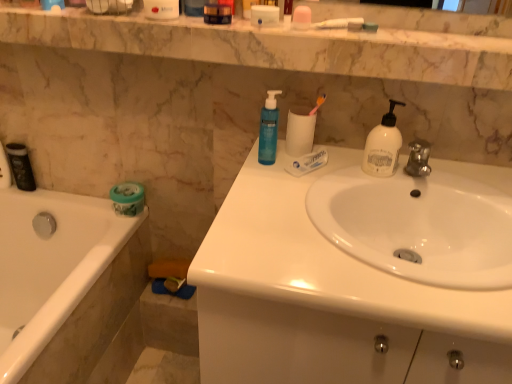
Question: Is marble at upper center to the left of white glossy bathtub at left from the viewer's perspective?

Choices:
 (A) no
 (B) yes

Answer: (A)

Question: From a real-world perspective, is marble at upper center on top of white glossy bathtub at left?

Choices:
 (A) yes
 (B) no

Answer: (A)

Question: From a real-world perspective, does marble at upper center sit lower than white glossy bathtub at left?

Choices:
 (A) no
 (B) yes

Answer: (A)

Question: Is marble at upper center positioned beyond the bounds of white glossy bathtub at left?

Choices:
 (A) no
 (B) yes

Answer: (B)

Question: Is marble at upper center positioned before white glossy bathtub at left?

Choices:
 (A) yes
 (B) no

Answer: (A)

Question: Considering the positions of point (287, 152) and point (300, 157), is point (287, 152) closer or farther from the camera than point (300, 157)?

Choices:
 (A) closer
 (B) farther

Answer: (B)

Question: Considering their positions, is white matte toilet paper at center, which is the second toilet paper in bottom-to-top order, located in front of or behind translucent white tube at center?

Choices:
 (A) front
 (B) behind

Answer: (B)

Question: Based on their positions, is white matte toilet paper at center, which is the second toilet paper in bottom-to-top order, located to the left or right of translucent white tube at center?

Choices:
 (A) right
 (B) left

Answer: (B)

Question: Which is correct: white matte toilet paper at center, which is the second toilet paper in bottom-to-top order, is inside translucent white tube at center, or outside of it?

Choices:
 (A) outside
 (B) inside

Answer: (A)

Question: In terms of height, does black matte canister at left look taller or shorter compared to white glossy sink at center, positioned as the 2th sink in top-to-bottom order?

Choices:
 (A) short
 (B) tall

Answer: (A)

Question: Is point (27, 185) closer or farther from the camera than point (343, 264)?

Choices:
 (A) farther
 (B) closer

Answer: (A)

Question: Considering the positions of black matte canister at left and white glossy sink at center, positioned as the 2th sink in top-to-bottom order, in the image, is black matte canister at left wider or thinner than white glossy sink at center, positioned as the 2th sink in top-to-bottom order,?

Choices:
 (A) wide
 (B) thin

Answer: (B)

Question: In the image, is black matte canister at left positioned in front of or behind white glossy sink at center, positioned as the 2th sink in top-to-bottom order?

Choices:
 (A) front
 (B) behind

Answer: (B)

Question: From a real-world perspective, is blue translucent pump bottle at upper center, positioned as the first soap dispenser in left-to-right order, above or below green matte jar at lower left, the 2th toilet paper positioned from the top?

Choices:
 (A) below
 (B) above

Answer: (B)

Question: From the image's perspective, is blue translucent pump bottle at upper center, positioned as the first soap dispenser in left-to-right order, located above or below green matte jar at lower left, the 1th toilet paper viewed from the left?

Choices:
 (A) above
 (B) below

Answer: (A)